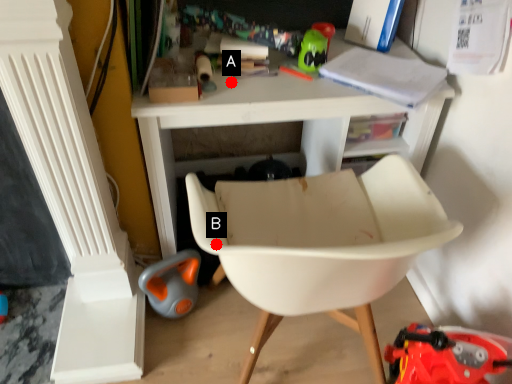
Question: Two points are circled on the image, labeled by A and B beside each circle. Which point is further to the camera?

Choices:
 (A) A is further
 (B) B is further

Answer: (A)